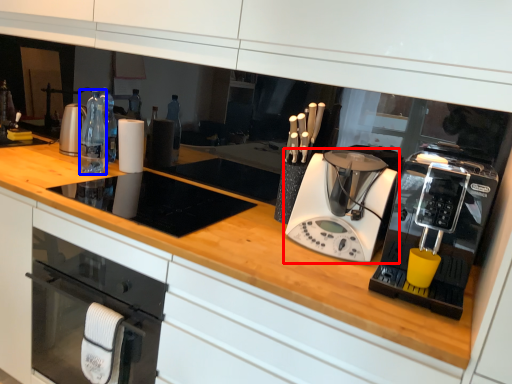
Question: Which of the following is the farthest to the observer, home appliance (highlighted by a red box) or bottle (highlighted by a blue box)?

Choices:
 (A) home appliance
 (B) bottle

Answer: (B)